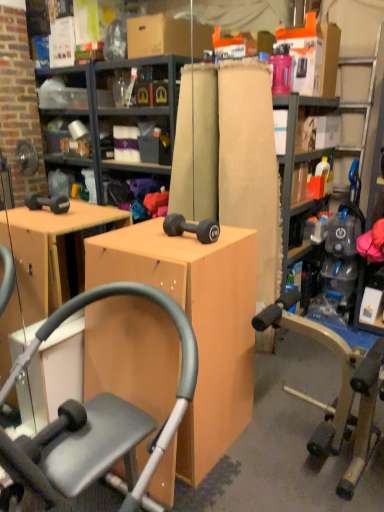
Where is `blank space to the left of matte black dumbbell at center`? The height and width of the screenshot is (512, 384). blank space to the left of matte black dumbbell at center is located at coordinates (142, 240).